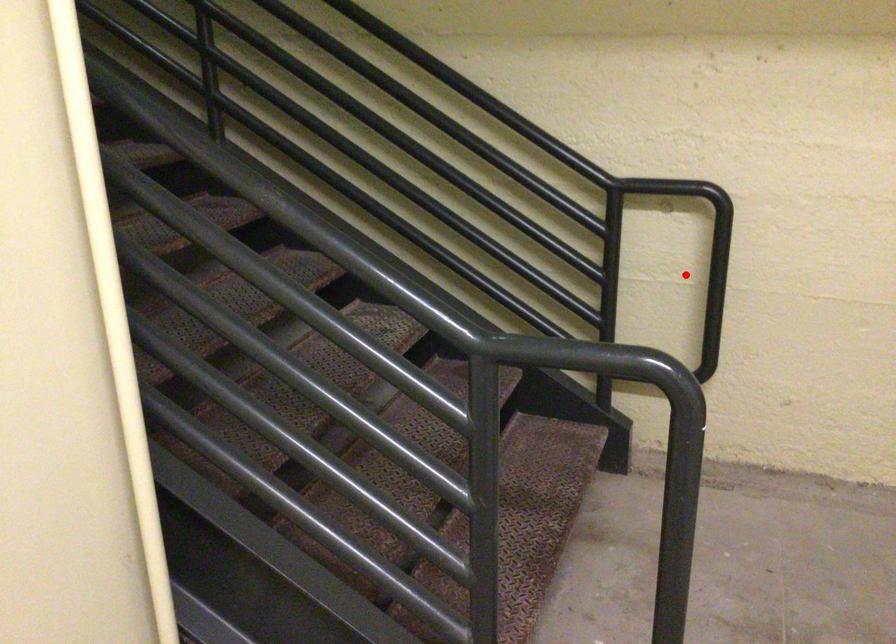
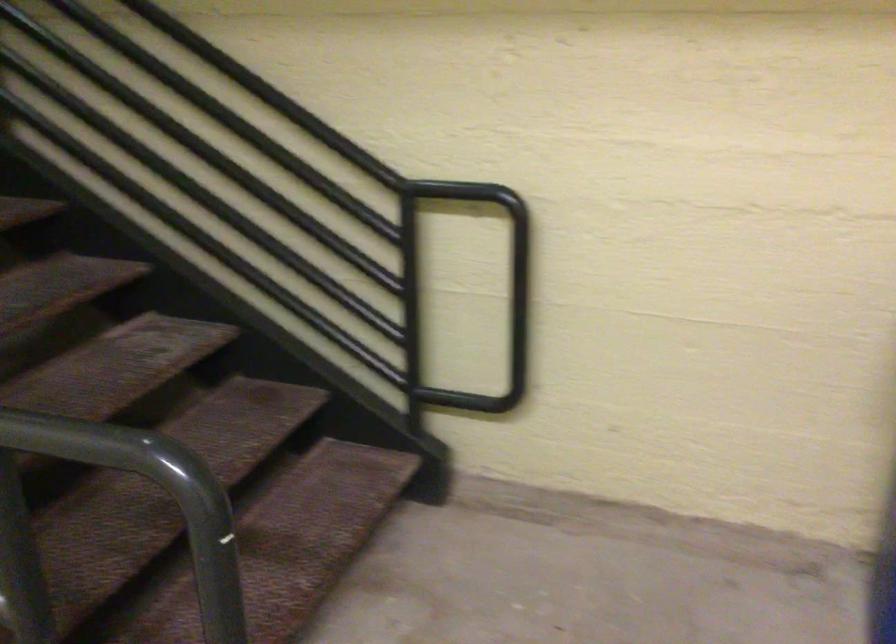
Locate, in the second image, the point that corresponds to the highlighted location in the first image.

(495, 301)